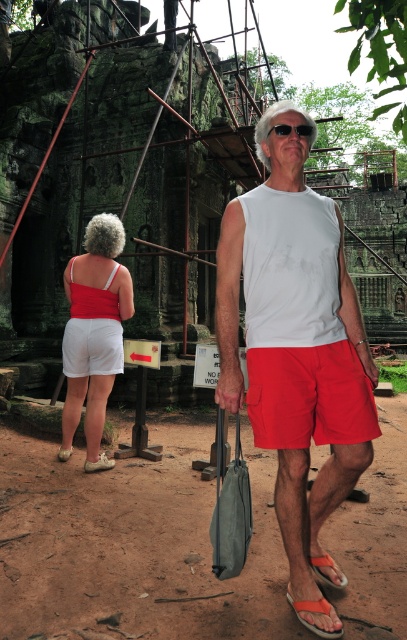
Based on the photo, you are standing at the edge of the brown dirt field at center and want to walk to the white matte tank top at center. Which direction should you go to reach the tank top without crossing the dirt field?

The brown dirt field at center might be wider than the white matte tank top at center, so you should walk towards the direction where the tank top is located but stay on the edge to avoid crossing the dirt field.

You are standing at the edge of the brown dirt field at center and looking towards the orange fabric sandal at lower center. Which object is closer to your right side?

The orange fabric sandal at lower center is closer to your right side because the brown dirt field at center is positioned on the left side of it.